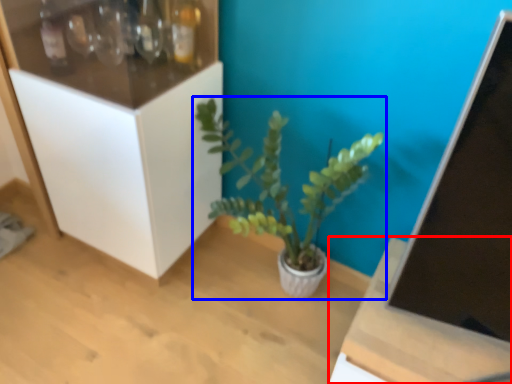
Question: Which of the following is the farthest to the observer, table (highlighted by a red box) or houseplant (highlighted by a blue box)?

Choices:
 (A) table
 (B) houseplant

Answer: (B)